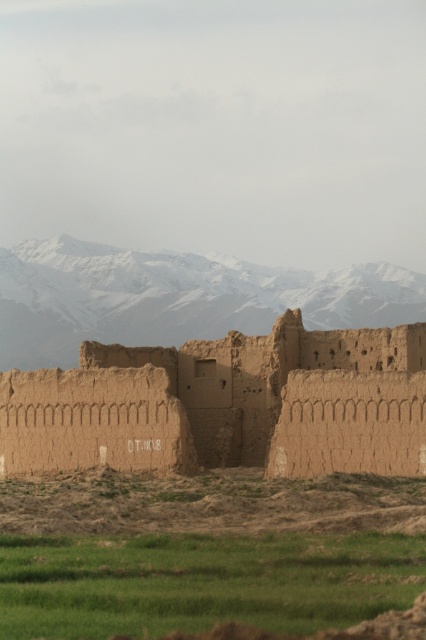
Question: Which point is farther to the camera?

Choices:
 (A) (143, 614)
 (B) (120, 419)
 (C) (0, 352)

Answer: (C)

Question: Among these objects, which one is nearest to the camera?

Choices:
 (A) snowy rock mountain range at upper center
 (B) brown mudbrick ruins at center
 (C) green grass at lower center

Answer: (C)

Question: Does green grass at lower center appear over brown mudbrick ruins at center?

Choices:
 (A) no
 (B) yes

Answer: (A)

Question: Does green grass at lower center have a greater width compared to snowy rock mountain range at upper center?

Choices:
 (A) no
 (B) yes

Answer: (A)

Question: Which point is farther to the camera?

Choices:
 (A) snowy rock mountain range at upper center
 (B) brown mudbrick ruins at center
 (C) green grass at lower center

Answer: (A)

Question: Is green grass at lower center to the left of snowy rock mountain range at upper center from the viewer's perspective?

Choices:
 (A) yes
 (B) no

Answer: (A)